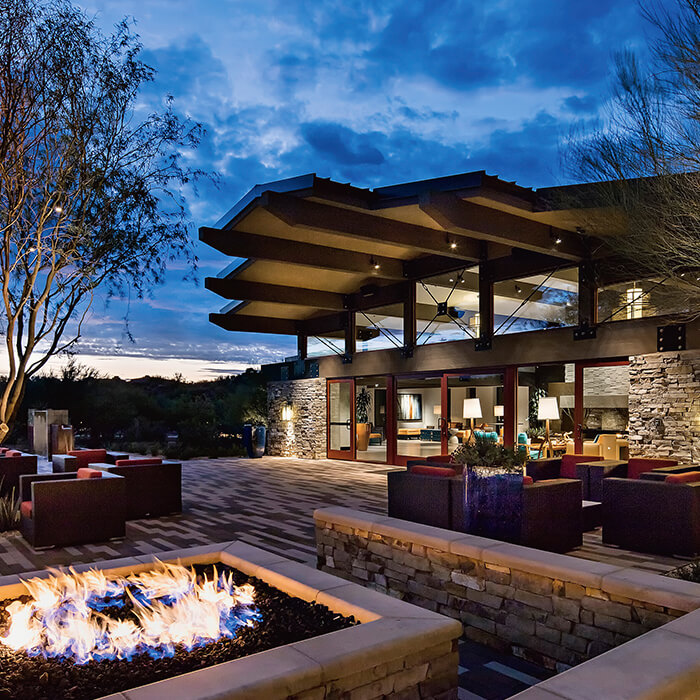
The height and width of the screenshot is (700, 700). In order to click on brick wall in this screenshot , I will do `click(488, 603)`.